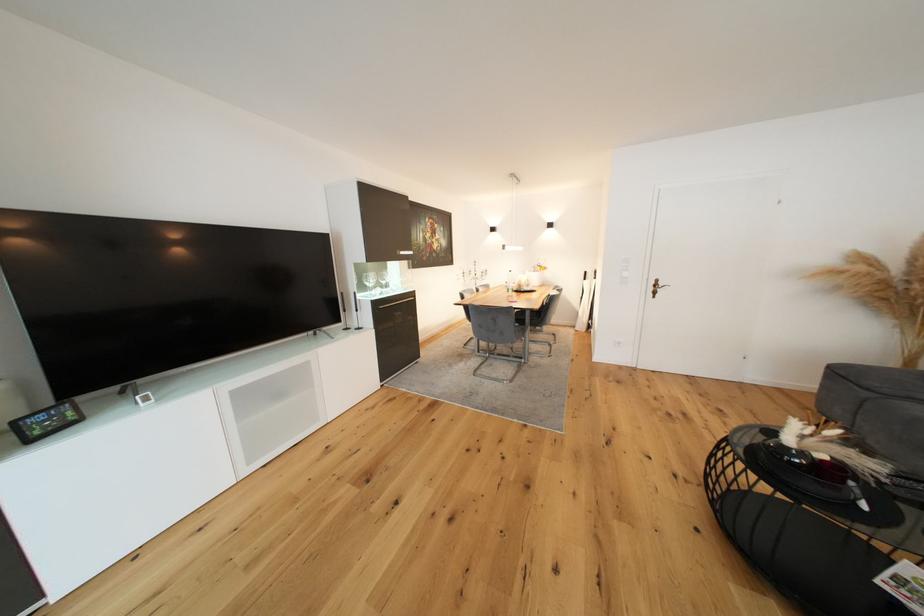
Find where to lift the digital display clock. Please return your answer as a coordinate pair (x, y).

(45, 421)